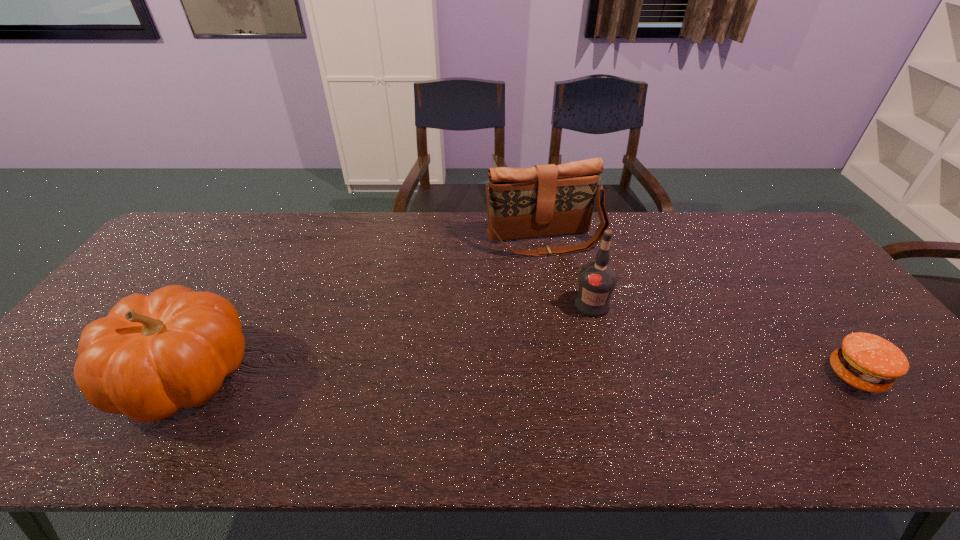
You are a GUI agent. You are given a task and a screenshot of the screen. Output one action in this format:
    pyautogui.click(x=<x>, y=<y>)
    Task: Click on the pumpkin
    
    Given the screenshot: What is the action you would take?
    pyautogui.click(x=153, y=355)

This screenshot has height=540, width=960. Find the location of `the shortest object`. the shortest object is located at coordinates (868, 362).

Where is `the rightmost object`? Image resolution: width=960 pixels, height=540 pixels. the rightmost object is located at coordinates (868, 362).

Identify the location of shoulder bag. (546, 200).

Locate an element on the screen. This screenshot has width=960, height=540. vodka is located at coordinates (597, 280).

Where is `blank area located on the right of the leftmost object`? Image resolution: width=960 pixels, height=540 pixels. blank area located on the right of the leftmost object is located at coordinates (326, 374).

I want to click on vacant space located on the back of the shortest object, so click(x=807, y=310).

Where is `free space located 0.330m on the front-facing side of the shoulder bag`? The image size is (960, 540). free space located 0.330m on the front-facing side of the shoulder bag is located at coordinates (591, 338).

The height and width of the screenshot is (540, 960). I want to click on vacant space positioned 0.340m on the front-facing side of the shoulder bag, so click(x=592, y=340).

You are a GUI agent. You are given a task and a screenshot of the screen. Output one action in this format:
    pyautogui.click(x=<x>, y=<y>)
    Task: Click on the vacant position located on the front-facing side of the shoulder bag
    
    Given the screenshot: What is the action you would take?
    pyautogui.click(x=575, y=300)